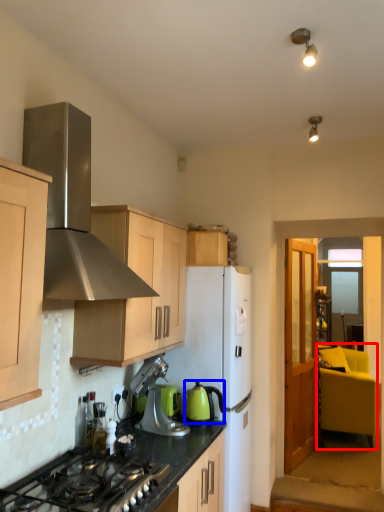
Question: Which point is closer to the camera, armchair (highlighted by a red box) or kitchen appliance (highlighted by a blue box)?

Choices:
 (A) armchair
 (B) kitchen appliance

Answer: (B)